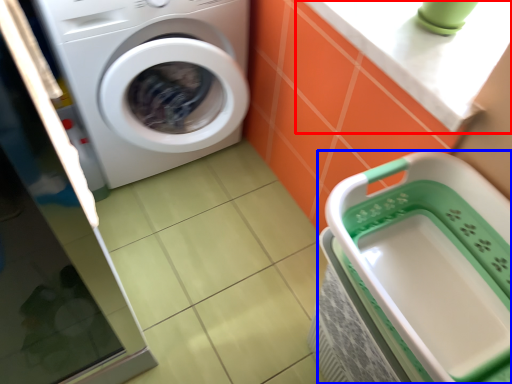
Question: Which of the following is the closest to the observer, counter top (highlighted by a red box) or dish washer (highlighted by a blue box)?

Choices:
 (A) counter top
 (B) dish washer

Answer: (B)